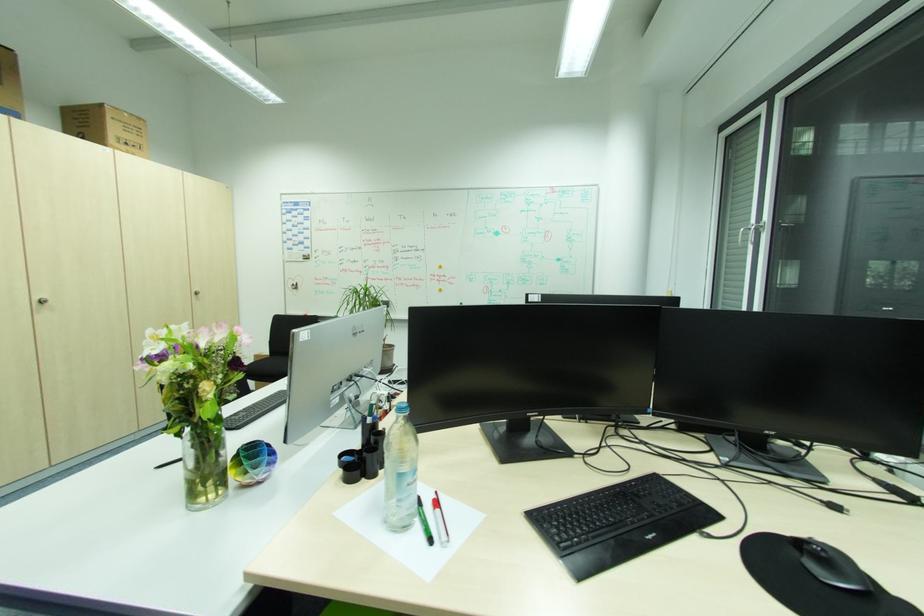
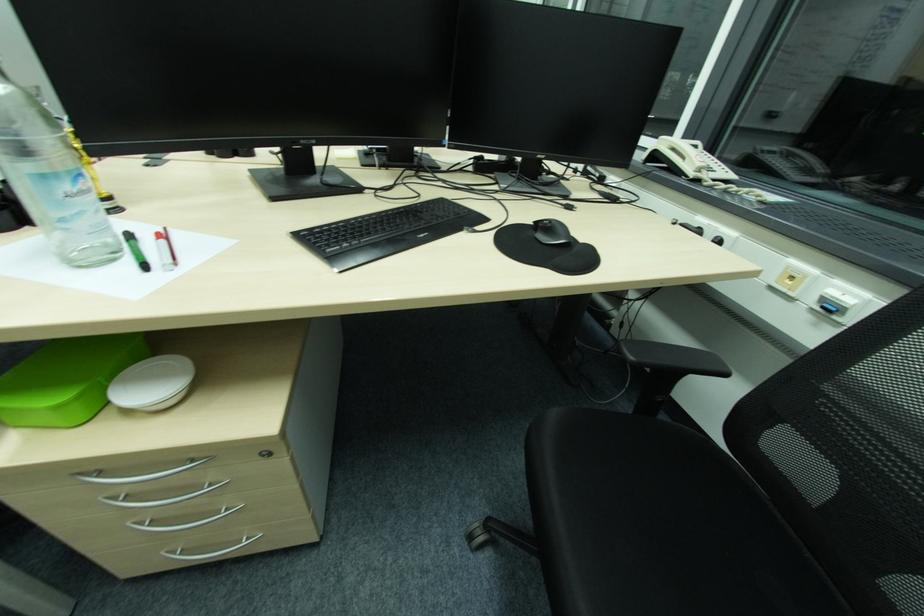
Find the pixel in the second image that matches point (444, 511) in the first image.

(167, 241)